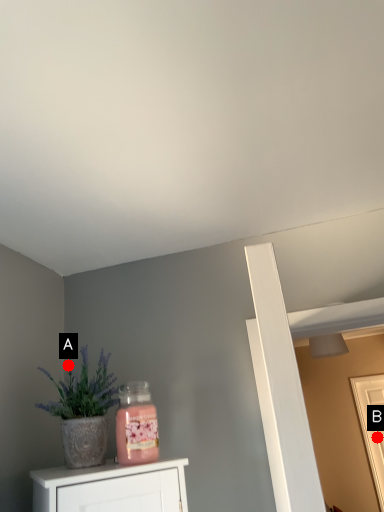
Question: Two points are circled on the image, labeled by A and B beside each circle. Which point is closer to the camera?

Choices:
 (A) A is closer
 (B) B is closer

Answer: (A)